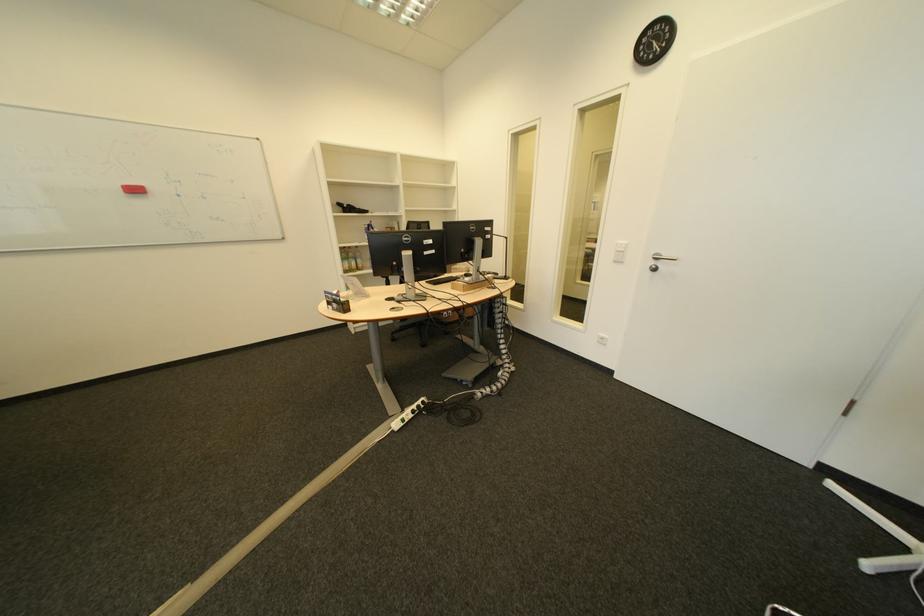
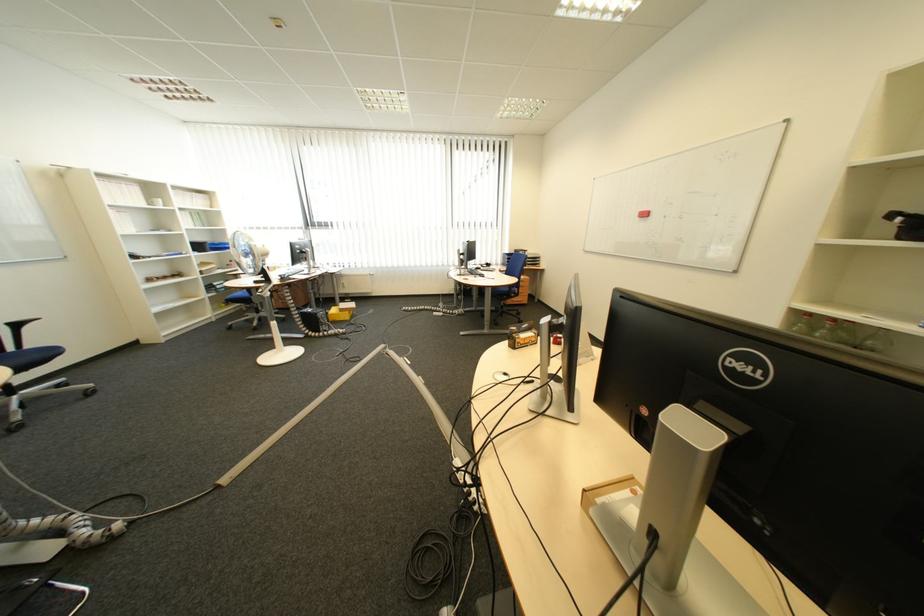
Locate, in the second image, the point that corresponds to point (192, 197) in the first image.

(677, 217)